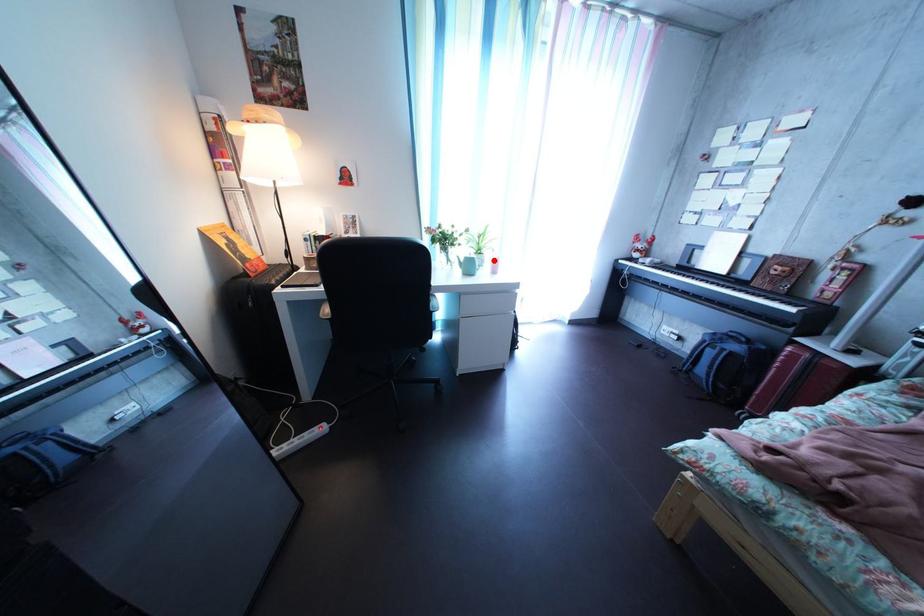
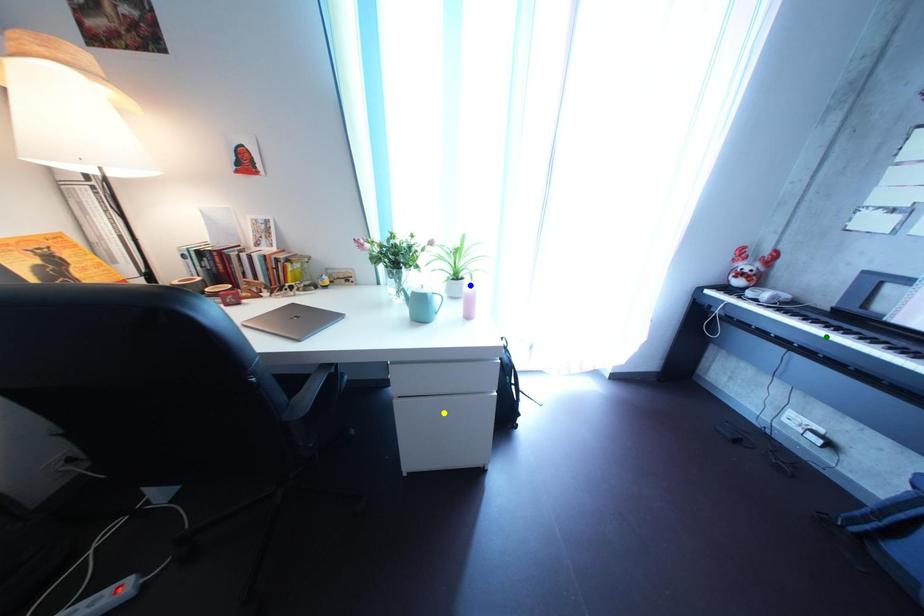
Question: I am providing you with two images of the same scene from different viewpoints. A red point is marked on the first image. You are given multiple points on the second image. Which spot in image 2 lines up with the point in image 1?

Choices:
 (A) green point
 (B) blue point
 (C) yellow point

Answer: (B)